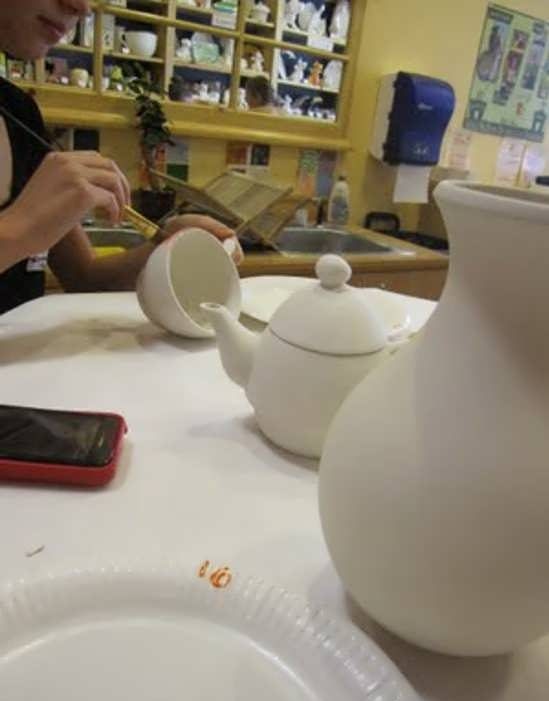
Find the location of a particular element. This screenshot has width=549, height=701. yellow wall is located at coordinates (447, 33).